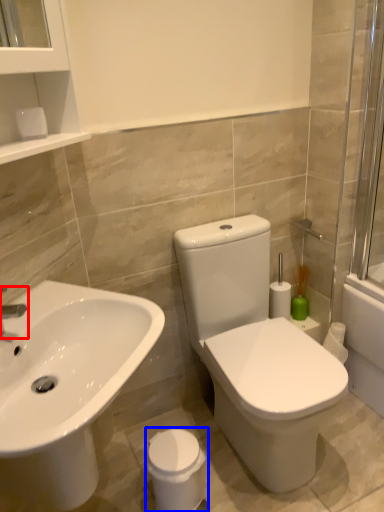
Question: Which point is closer to the camera, tap (highlighted by a red box) or porcelain (highlighted by a blue box)?

Choices:
 (A) tap
 (B) porcelain

Answer: (A)